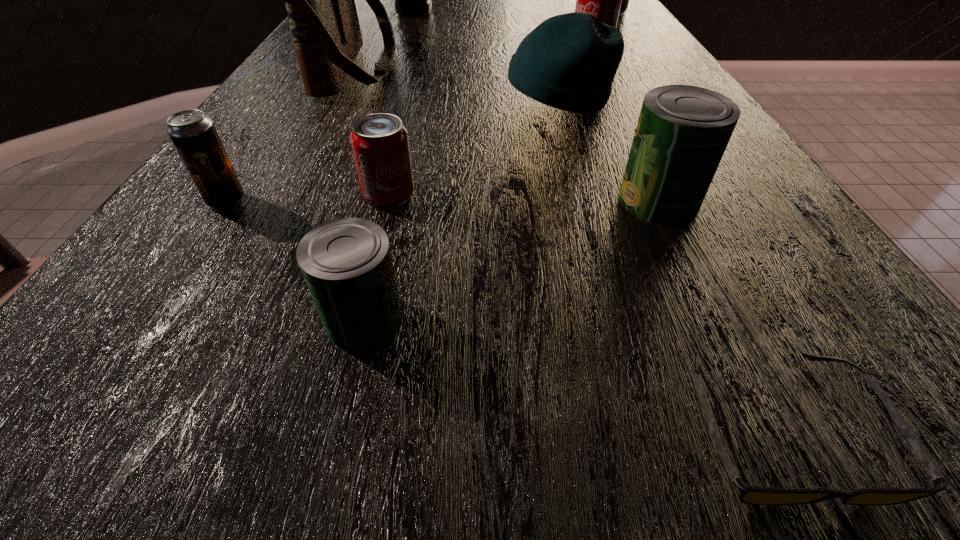
At what (x,y) coordinates should I click in order to perform the action: click on the closest red can relative to the beer can. Please return your answer as a coordinate pair (x, y). The height and width of the screenshot is (540, 960). Looking at the image, I should click on (380, 143).

Find the location of `red can identified as the second closest to the black beer can`. red can identified as the second closest to the black beer can is located at coordinates (603, 0).

The height and width of the screenshot is (540, 960). I want to click on vacant region that satisfies the following two spatial constraints: 1. on the back side of the black beer can; 2. on the right side of the bigger green can, so click(227, 200).

Locate an element on the screen. free spot that satisfies the following two spatial constraints: 1. on the front-facing side of the bigger green can; 2. on the right side of the shoulder bag is located at coordinates (294, 200).

Find the location of a particular element. vacant space that satisfies the following two spatial constraints: 1. on the front-facing side of the tallest object; 2. on the right side of the nearer green can is located at coordinates (309, 319).

The height and width of the screenshot is (540, 960). I want to click on blank area in the image that satisfies the following two spatial constraints: 1. on the front side of the beanie; 2. on the right side of the bigger green can, so click(x=588, y=200).

Where is `blank space that satisfies the following two spatial constraints: 1. on the front side of the tallest can; 2. on the front-facing side of the shoulder bag`? blank space that satisfies the following two spatial constraints: 1. on the front side of the tallest can; 2. on the front-facing side of the shoulder bag is located at coordinates (641, 69).